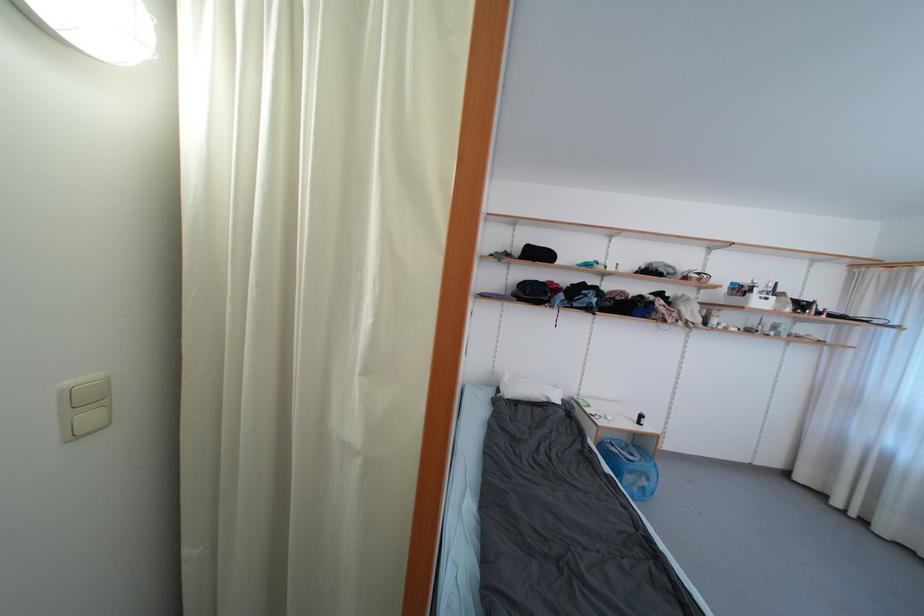
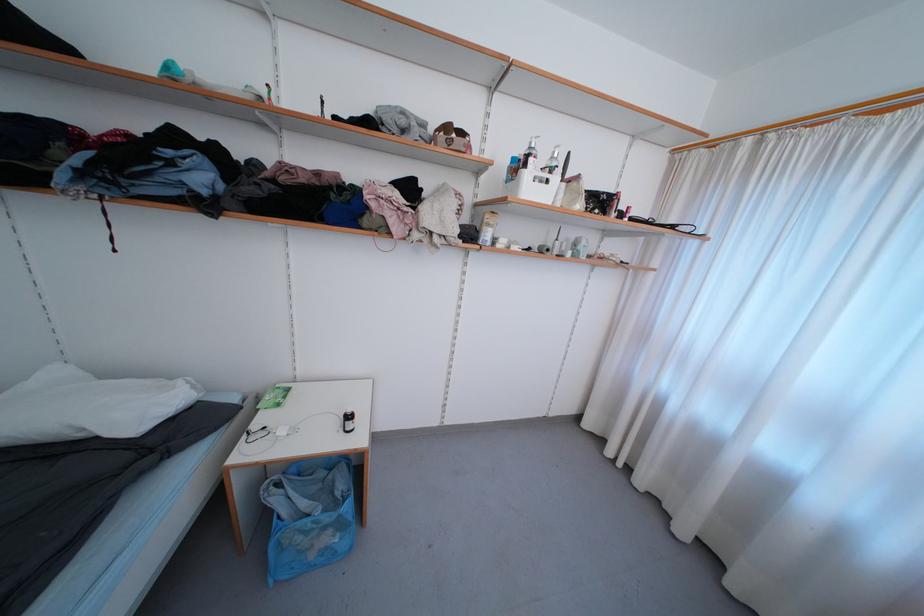
Where in the second image is the point corresponding to [793,312] from the first image?

(584, 208)